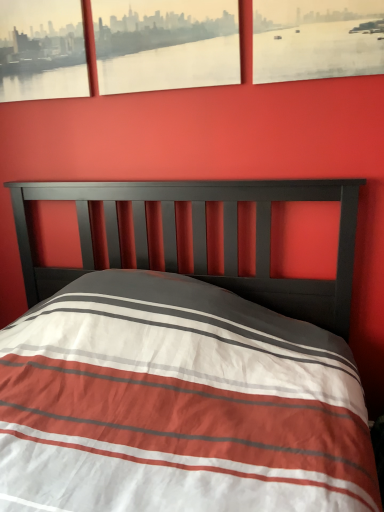
Question: Does point (13, 14) appear closer or farther from the camera than point (344, 56)?

Choices:
 (A) farther
 (B) closer

Answer: (A)

Question: From their relative heights in the image, would you say matte black picture frame at upper left, the third picture frame viewed from the right, is taller or shorter than matte paper picture frame at upper right, the third picture frame when ordered from left to right?

Choices:
 (A) short
 (B) tall

Answer: (B)

Question: Estimate the real-world distances between objects in this image. Which object is closer to the matte paper picture frame at upper right, the third picture frame when ordered from left to right?

Choices:
 (A) matte black picture frame at upper left, the third picture frame viewed from the right
 (B) matte paper picture frame at upper center, the second picture frame in the right-to-left sequence

Answer: (B)

Question: Estimate the real-world distances between objects in this image. Which object is closer to the matte paper picture frame at upper center, the second picture frame in the right-to-left sequence?

Choices:
 (A) matte black picture frame at upper left, acting as the first picture frame starting from the left
 (B) matte paper picture frame at upper right, the third picture frame when ordered from left to right

Answer: (A)